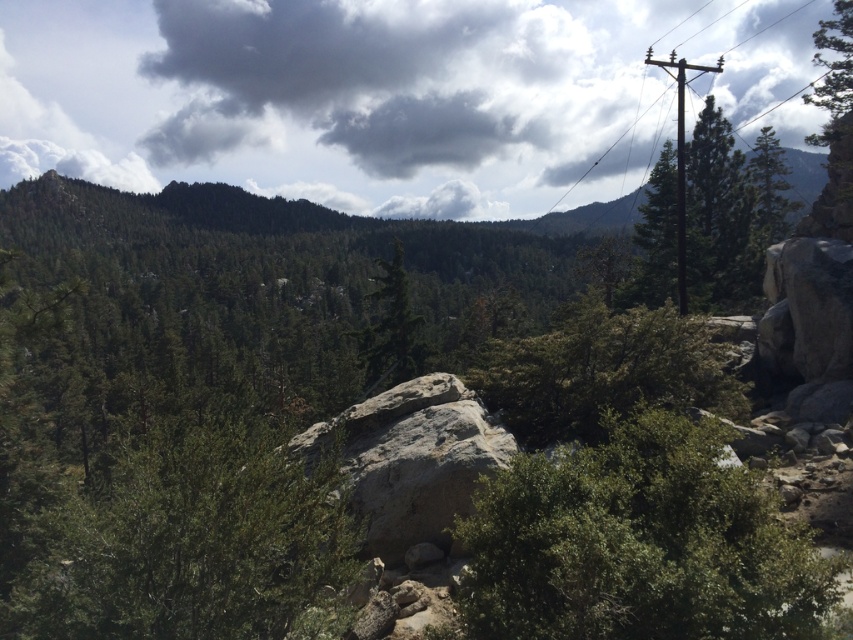
Question: Can you confirm if green leafy shrub at center is wider than green matte tree at center?

Choices:
 (A) no
 (B) yes

Answer: (A)

Question: Based on their relative distances, which object is nearer to the green leafy shrub at center?

Choices:
 (A) metallic wire at upper right
 (B) green matte tree at center-left

Answer: (B)

Question: Which point is closer to the camera taking this photo?

Choices:
 (A) (640, 356)
 (B) (654, 276)

Answer: (A)

Question: Does brown wooden pole at upper right appear on the left side of metallic wire at upper right?

Choices:
 (A) yes
 (B) no

Answer: (B)

Question: Among these points, which one is farthest from the camera?

Choices:
 (A) (525, 179)
 (B) (683, 220)
 (C) (712, 177)

Answer: (A)

Question: Is green leafy bush at center below green leafy shrub at center?

Choices:
 (A) no
 (B) yes

Answer: (B)